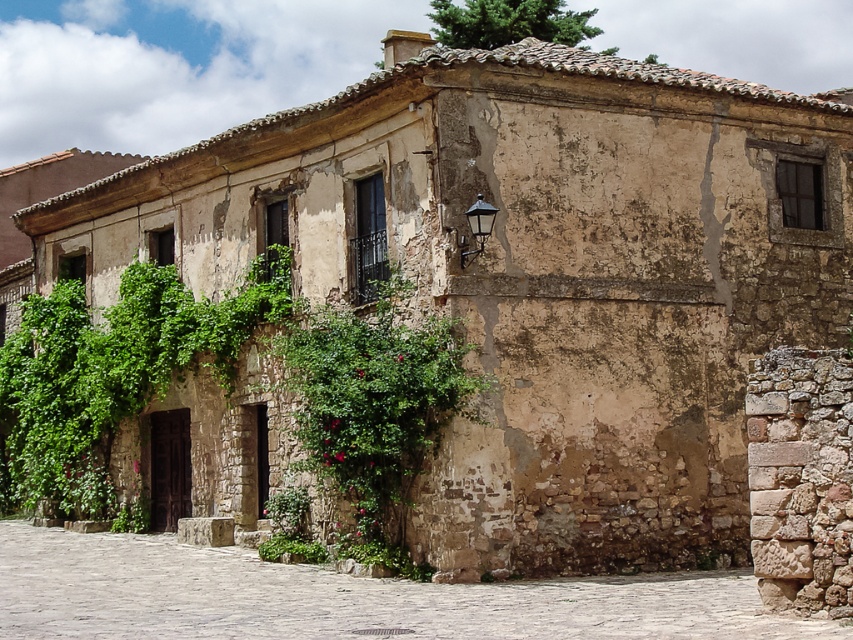
Question: Can you confirm if stone paved alley at center is positioned to the right of green leafy bush at center?

Choices:
 (A) no
 (B) yes

Answer: (A)

Question: Observing the image, what is the correct spatial positioning of stone paved alley at center in reference to green leafy bush at center?

Choices:
 (A) right
 (B) left

Answer: (B)

Question: Is stone paved alley at center thinner than green leafy bush at center?

Choices:
 (A) no
 (B) yes

Answer: (A)

Question: Among these objects, which one is nearest to the camera?

Choices:
 (A) green leafy bush at center
 (B) stone paved alley at center

Answer: (B)

Question: Which point is farther to the camera?

Choices:
 (A) (387, 312)
 (B) (654, 627)

Answer: (A)

Question: Among these points, which one is nearest to the camera?

Choices:
 (A) (434, 412)
 (B) (482, 588)

Answer: (B)